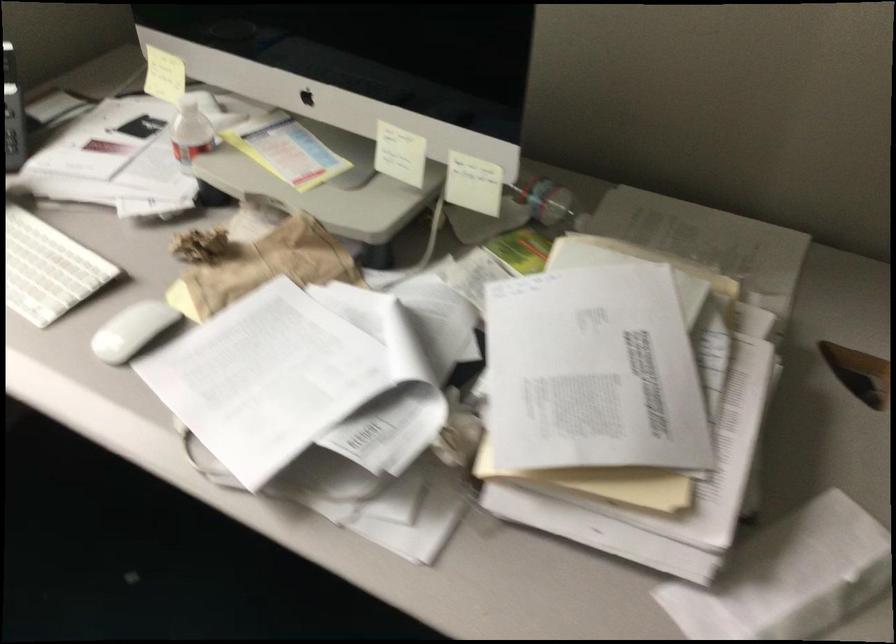
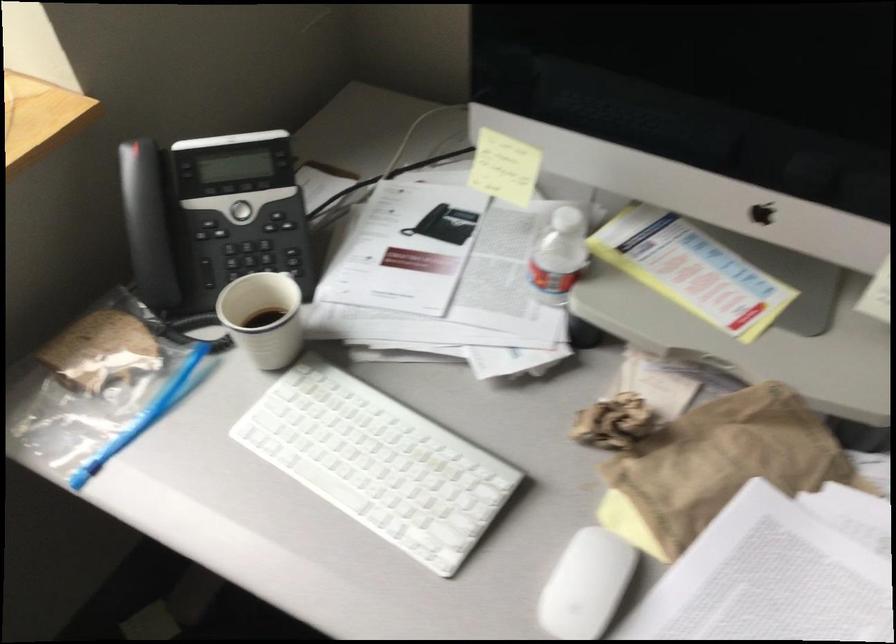
In the second image, find the point that corresponds to pixel 174 75 in the first image.

(504, 167)